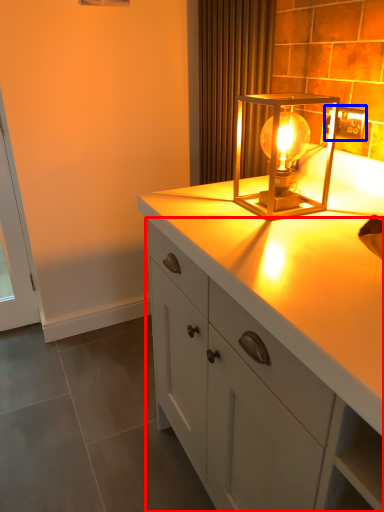
Question: Among these objects, which one is nearest to the camera, cabinetry (highlighted by a red box) or electric outlet (highlighted by a blue box)?

Choices:
 (A) cabinetry
 (B) electric outlet

Answer: (A)